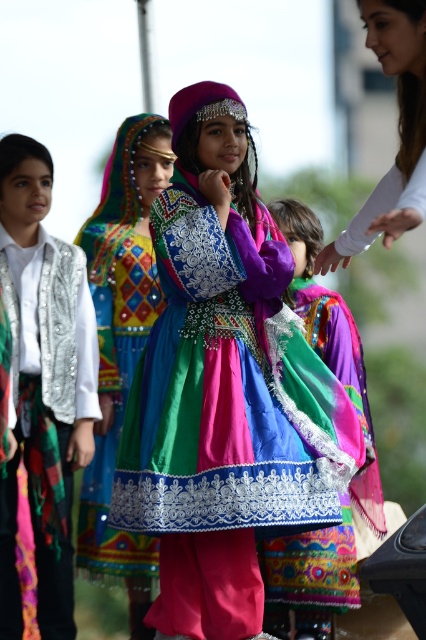
Based on the scene description, where is the silver sequined vest at left located in the image?

The silver sequined vest at left is located at point 0.616 on the x axis and 0.117 on the y axis.